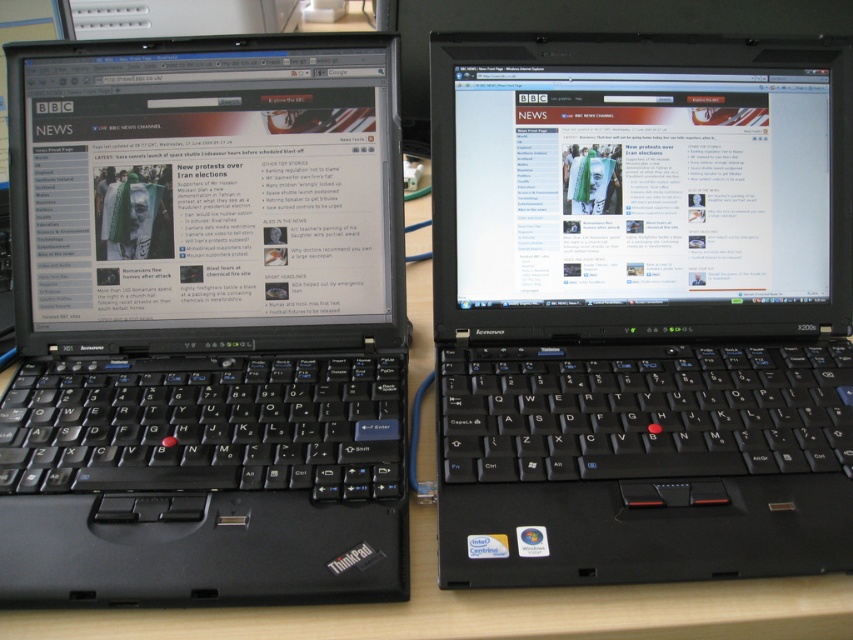
You are organizing a workspace and need to place a new monitor on the desk. The monitor requires a space that is wider than the distance between the black plastic laptop at left and the wooden table at center. Is there enough space on the desk for the monitor?

The black plastic laptop at left is positioned on the left side of wooden table at center. Since the laptop is already placed on the table, the desk space available for the monitor would depend on the total desk width. However, the description does not provide specific measurements between the laptop and the table, so it cannot be determined if there is enough space.

You are organizing a photo shoot and need to ensure that the green fabric couple at center is visible in the background behind the black plastic laptop at left. Based on the scene description, will the current arrangement allow this?

The black plastic laptop at left is in front of the green fabric couple at center, so the laptop is blocking the view of the couple. To make the couple visible in the background, the laptop should be moved aside or positioned behind them.